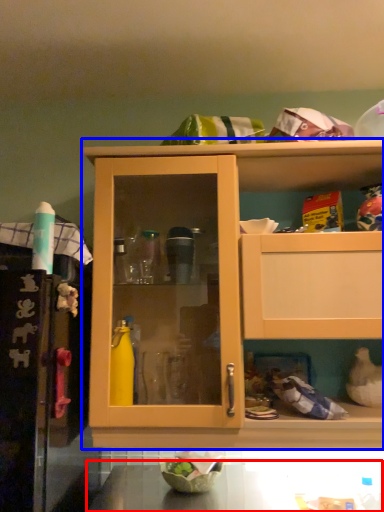
Question: Among these objects, which one is nearest to the camera, counter top (highlighted by a red box) or cabinetry (highlighted by a blue box)?

Choices:
 (A) counter top
 (B) cabinetry

Answer: (A)